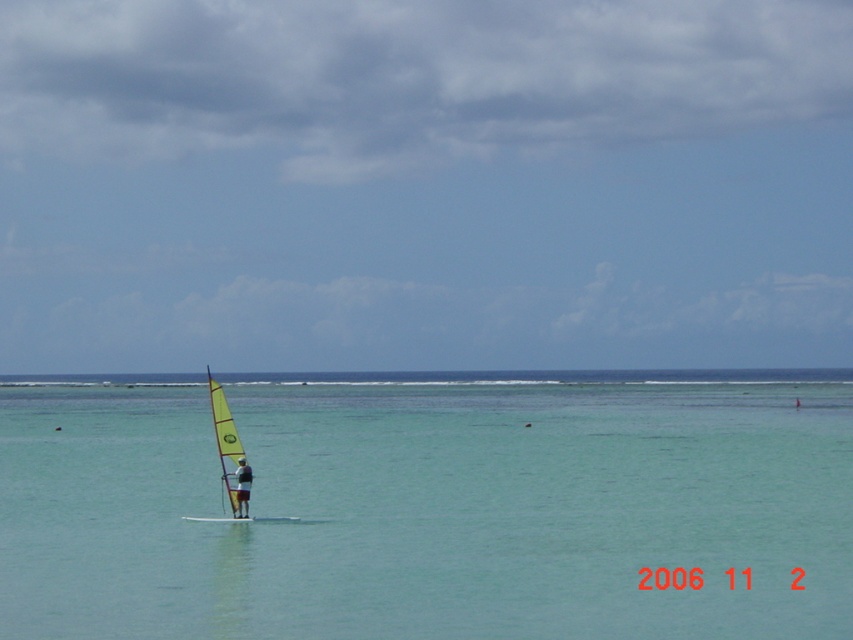
Can you confirm if clear blue water at center is smaller than dark gray fabric windsurfer at center?

No, clear blue water at center is not smaller than dark gray fabric windsurfer at center.

Is clear blue water at center to the right of dark gray fabric windsurfer at center from the viewer's perspective?

Yes, clear blue water at center is to the right of dark gray fabric windsurfer at center.

Does point (115, 536) lie in front of point (238, 465)?

Yes, it is in front of point (238, 465).

You are a GUI agent. You are given a task and a screenshot of the screen. Output one action in this format:
    pyautogui.click(x=<x>, y=<y>)
    Task: Click on the clear blue water at center
    The height and width of the screenshot is (640, 853).
    Given the screenshot: What is the action you would take?
    pyautogui.click(x=428, y=509)

Can you confirm if yellow matte sailboat at center is positioned to the left of dark gray fabric windsurfer at center?

Correct, you'll find yellow matte sailboat at center to the left of dark gray fabric windsurfer at center.

Between yellow matte sailboat at center and dark gray fabric windsurfer at center, which one appears on the left side from the viewer's perspective?

yellow matte sailboat at center

Where is `yellow matte sailboat at center`? This screenshot has height=640, width=853. yellow matte sailboat at center is located at coordinates (231, 460).

Locate an element on the screen. yellow matte sailboat at center is located at coordinates (231, 460).

Which is more to the right, clear blue water at center or yellow matte sailboat at center?

From the viewer's perspective, clear blue water at center appears more on the right side.

Is clear blue water at center to the left of yellow matte sailboat at center from the viewer's perspective?

No, clear blue water at center is not to the left of yellow matte sailboat at center.

You are a GUI agent. You are given a task and a screenshot of the screen. Output one action in this format:
    pyautogui.click(x=<x>, y=<y>)
    Task: Click on the clear blue water at center
    The image size is (853, 640).
    Given the screenshot: What is the action you would take?
    pyautogui.click(x=428, y=509)